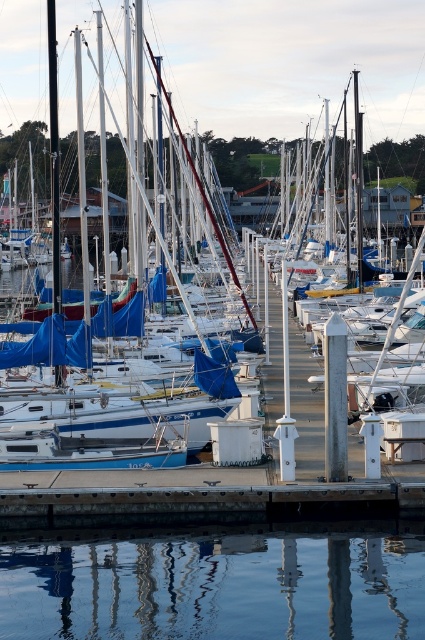
Question: Which of these objects is positioned closest to the blue tarpaulin sailboat at center?

Choices:
 (A) smooth concrete dock at center
 (B) transparent water at center

Answer: (A)

Question: Estimate the real-world distances between objects in this image. Which object is farther from the blue tarpaulin sailboat at center?

Choices:
 (A) smooth concrete dock at center
 (B) transparent water at center

Answer: (B)

Question: Which of these objects is positioned closest to the smooth concrete dock at center?

Choices:
 (A) transparent water at center
 (B) blue tarpaulin sailboat at center

Answer: (A)

Question: Where is transparent water at center located in relation to smooth concrete dock at center in the image?

Choices:
 (A) above
 (B) below

Answer: (B)

Question: Is transparent water at center bigger than blue tarpaulin sailboat at center?

Choices:
 (A) no
 (B) yes

Answer: (A)

Question: Is transparent water at center above blue tarpaulin sailboat at center?

Choices:
 (A) no
 (B) yes

Answer: (A)